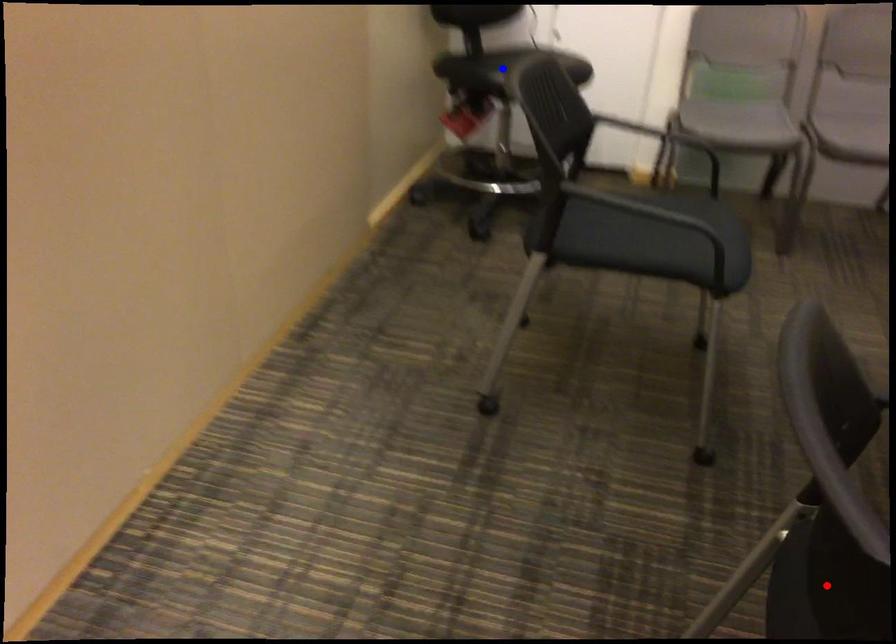
Question: Two points are marked on the image. Which point is closer to the camera?

Choices:
 (A) Blue point is closer.
 (B) Red point is closer.

Answer: (B)